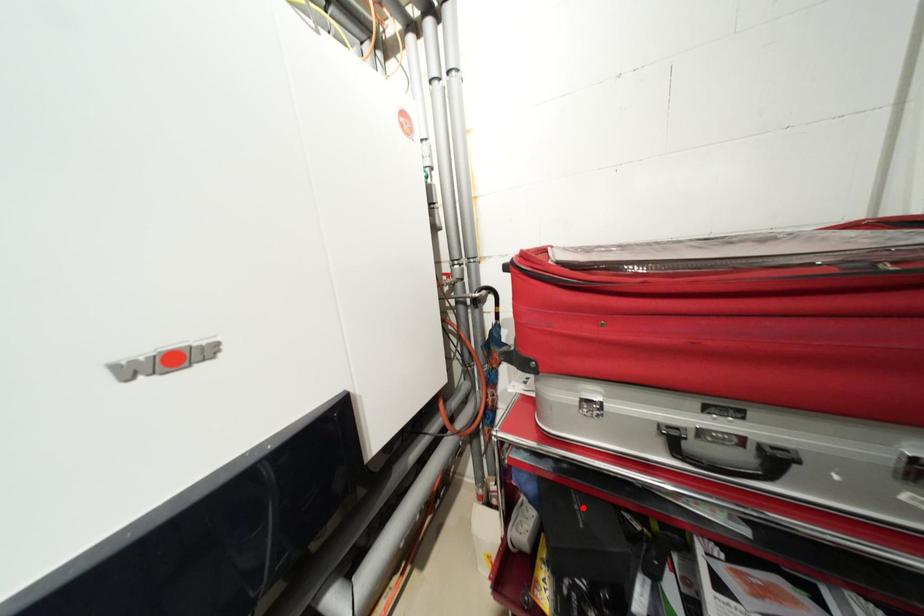
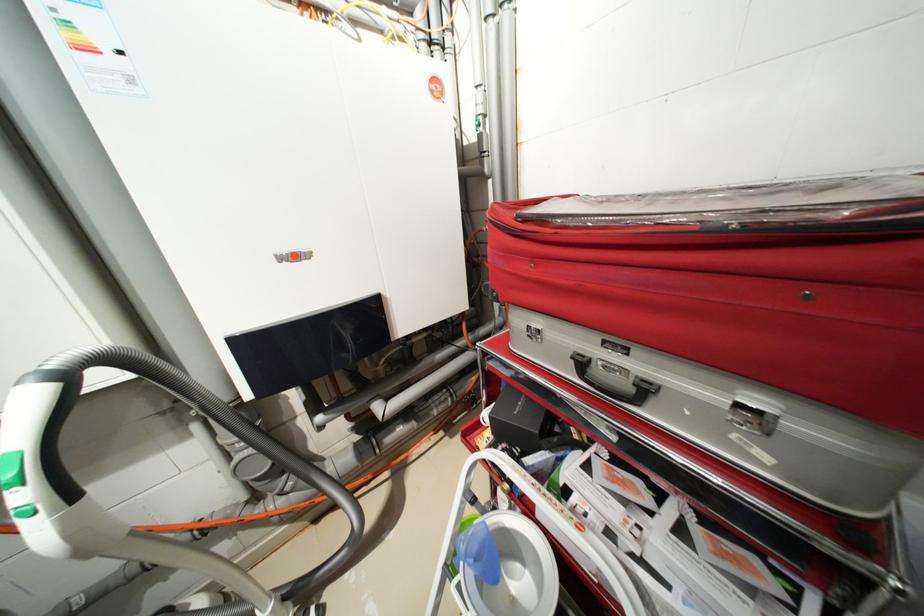
Where in the second image is the point corresponding to the highlighted location from the first image?

(527, 403)